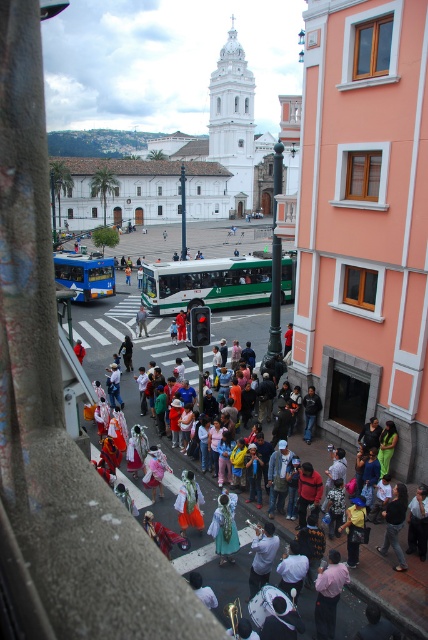
You are a photographer trying to capture both the white cotton dress at center and the pink fabric dress at lower center in a single frame. Based on their positions, which dress should you adjust your camera angle to focus on first if you want to include both without moving closer?

The white cotton dress at center is to the left of the pink fabric dress at lower center, so you should focus on the white cotton dress at center first to ensure both are in frame.